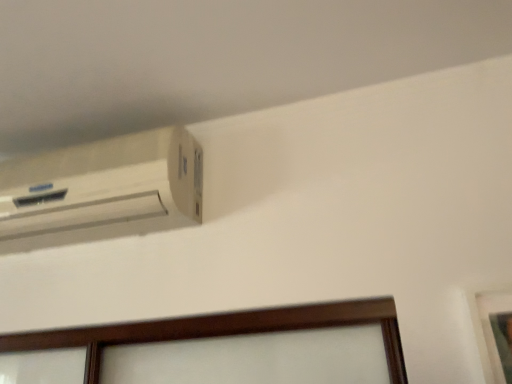
The image size is (512, 384). What do you see at coordinates (492, 328) in the screenshot?
I see `wooden picture frame at lower right` at bounding box center [492, 328].

Find the location of a particular element. This screenshot has height=384, width=512. wooden picture frame at lower right is located at coordinates (492, 328).

Locate an element on the screen. The width and height of the screenshot is (512, 384). white matte air conditioning at upper left is located at coordinates (102, 190).

What do you see at coordinates (102, 190) in the screenshot?
I see `white matte air conditioning at upper left` at bounding box center [102, 190].

Find the location of a particular element. The height and width of the screenshot is (384, 512). wooden picture frame at lower right is located at coordinates (492, 328).

Is white matte air conditioning at upper left to the left or to the right of wooden picture frame at lower right in the image?

Clearly, white matte air conditioning at upper left is on the left of wooden picture frame at lower right in the image.

Is white matte air conditioning at upper left positioned in front of wooden picture frame at lower right?

No, white matte air conditioning at upper left is further to the viewer.

Between point (66, 194) and point (496, 360), which one is positioned behind?

Positioned behind is point (66, 194).

From the image's perspective, would you say white matte air conditioning at upper left is positioned over wooden picture frame at lower right?

Yes, from the image's perspective, white matte air conditioning at upper left is over wooden picture frame at lower right.

Looking at this image, from a real-world perspective, is white matte air conditioning at upper left on wooden picture frame at lower right?

Indeed, from a real-world perspective, white matte air conditioning at upper left stands above wooden picture frame at lower right.

Considering the sizes of objects white matte air conditioning at upper left and wooden picture frame at lower right in the image provided, who is thinner, white matte air conditioning at upper left or wooden picture frame at lower right?

Thinner between the two is wooden picture frame at lower right.

Who is shorter, white matte air conditioning at upper left or wooden picture frame at lower right?

white matte air conditioning at upper left.

Can you confirm if white matte air conditioning at upper left is bigger than wooden picture frame at lower right?

Yes, white matte air conditioning at upper left is bigger than wooden picture frame at lower right.

Which is correct: white matte air conditioning at upper left is inside wooden picture frame at lower right, or outside of it?

white matte air conditioning at upper left is located beyond the bounds of wooden picture frame at lower right.

Is white matte air conditioning at upper left placed right next to wooden picture frame at lower right?

No.

Could you tell me if white matte air conditioning at upper left is turned towards wooden picture frame at lower right?

No, white matte air conditioning at upper left is not facing towards wooden picture frame at lower right.

The image size is (512, 384). Identify the location of air conditioning above the wooden picture frame at lower right (from the image's perspective). (102, 190).

Can you confirm if wooden picture frame at lower right is positioned to the left of white matte air conditioning at upper left?

No, wooden picture frame at lower right is not to the left of white matte air conditioning at upper left.

Considering the positions of objects wooden picture frame at lower right and white matte air conditioning at upper left in the image provided, who is behind, wooden picture frame at lower right or white matte air conditioning at upper left?

white matte air conditioning at upper left is more distant.

Is point (492, 356) behind point (96, 175)?

No, (492, 356) is closer to viewer.

From the picture: From the image's perspective, is wooden picture frame at lower right below white matte air conditioning at upper left?

Correct, wooden picture frame at lower right appears lower than white matte air conditioning at upper left in the image.

From a real-world perspective, which object rests below the other?

From a 3D spatial view, wooden picture frame at lower right is below.

Considering the relative sizes of wooden picture frame at lower right and white matte air conditioning at upper left in the image provided, is wooden picture frame at lower right thinner than white matte air conditioning at upper left?

Yes, wooden picture frame at lower right is thinner than white matte air conditioning at upper left.

Between wooden picture frame at lower right and white matte air conditioning at upper left, which one has less height?

With less height is white matte air conditioning at upper left.

Based on the photo, does wooden picture frame at lower right have a larger size compared to white matte air conditioning at upper left?

Incorrect, wooden picture frame at lower right is not larger than white matte air conditioning at upper left.

Is white matte air conditioning at upper left inside wooden picture frame at lower right?

No.

Is the surface of wooden picture frame at lower right in direct contact with white matte air conditioning at upper left?

No, wooden picture frame at lower right is not beside white matte air conditioning at upper left.

Is wooden picture frame at lower right turned away from white matte air conditioning at upper left?

wooden picture frame at lower right is not turned away from white matte air conditioning at upper left.

Looking at this image, how far apart are wooden picture frame at lower right and white matte air conditioning at upper left?

The distance of wooden picture frame at lower right from white matte air conditioning at upper left is 35.51 inches.

The height and width of the screenshot is (384, 512). In order to click on picture frame located underneath the white matte air conditioning at upper left (from a real-world perspective) in this screenshot , I will do `click(492, 328)`.

Identify the location of air conditioning above the wooden picture frame at lower right (from the image's perspective). (102, 190).

I want to click on picture frame lying on the right of white matte air conditioning at upper left, so tap(492, 328).